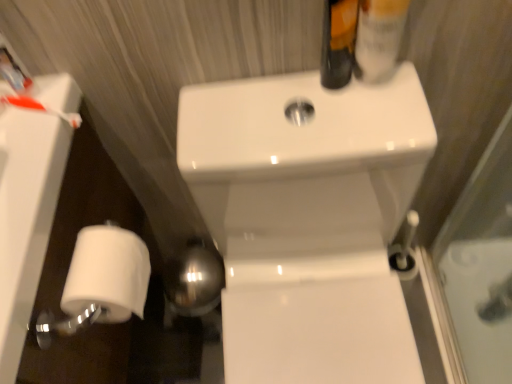
Question: From a real-world perspective, is translucent plastic mouthwash at upper right positioned under matte black bottle at upper right based on gravity?

Choices:
 (A) no
 (B) yes

Answer: (A)

Question: Is translucent plastic mouthwash at upper right taller than matte black bottle at upper right?

Choices:
 (A) no
 (B) yes

Answer: (B)

Question: From the image's perspective, is translucent plastic mouthwash at upper right under matte black bottle at upper right?

Choices:
 (A) yes
 (B) no

Answer: (B)

Question: Can you confirm if translucent plastic mouthwash at upper right is shorter than matte black bottle at upper right?

Choices:
 (A) no
 (B) yes

Answer: (A)

Question: Is translucent plastic mouthwash at upper right aimed at matte black bottle at upper right?

Choices:
 (A) yes
 (B) no

Answer: (B)

Question: Is white matte toilet paper at lower left inside or outside of translucent plastic mouthwash at upper right?

Choices:
 (A) inside
 (B) outside

Answer: (B)

Question: From the image's perspective, relative to translucent plastic mouthwash at upper right, is white matte toilet paper at lower left above or below?

Choices:
 (A) below
 (B) above

Answer: (A)

Question: Looking at the image, does white matte toilet paper at lower left seem bigger or smaller compared to translucent plastic mouthwash at upper right?

Choices:
 (A) small
 (B) big

Answer: (B)

Question: Is white matte toilet paper at lower left taller or shorter than translucent plastic mouthwash at upper right?

Choices:
 (A) tall
 (B) short

Answer: (B)

Question: In terms of width, does white matte toilet paper at lower left look wider or thinner when compared to white matte toilet paper at lower left?

Choices:
 (A) wide
 (B) thin

Answer: (B)

Question: From a real-world perspective, is white matte toilet paper at lower left above or below white matte toilet paper at lower left?

Choices:
 (A) below
 (B) above

Answer: (B)

Question: Considering their positions, is white matte toilet paper at lower left located in front of or behind white matte toilet paper at lower left?

Choices:
 (A) behind
 (B) front

Answer: (A)

Question: Considering the positions of white matte toilet paper at lower left and white matte toilet paper at lower left in the image, is white matte toilet paper at lower left bigger or smaller than white matte toilet paper at lower left?

Choices:
 (A) big
 (B) small

Answer: (B)

Question: Considering the positions of white glossy sink at center and translucent plastic mouthwash at upper right in the image, is white glossy sink at center wider or thinner than translucent plastic mouthwash at upper right?

Choices:
 (A) thin
 (B) wide

Answer: (B)

Question: From the image's perspective, is white glossy sink at center located above or below translucent plastic mouthwash at upper right?

Choices:
 (A) below
 (B) above

Answer: (A)